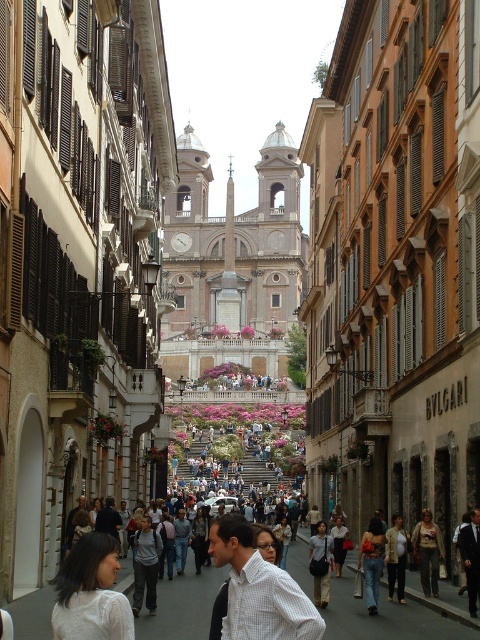
You are standing at the center of the bustling street in Rome. You notice a white matte shirt at lower left. If you want to approach the person wearing it, in which general direction should you move from your current position?

The white matte shirt at lower left is located at point (91, 593), which is towards the lower left area of the scene. To approach it, you should move towards the lower left direction from your current position at the center.